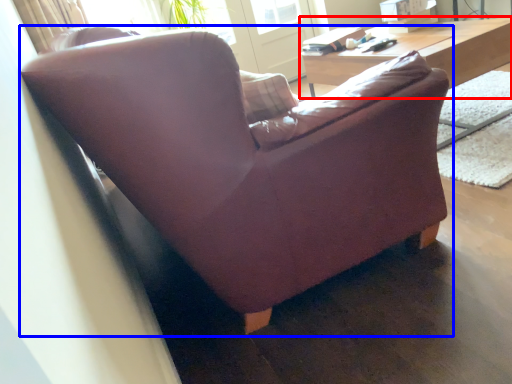
Question: Which object is closer to the camera taking this photo, table (highlighted by a red box) or studio couch (highlighted by a blue box)?

Choices:
 (A) table
 (B) studio couch

Answer: (B)